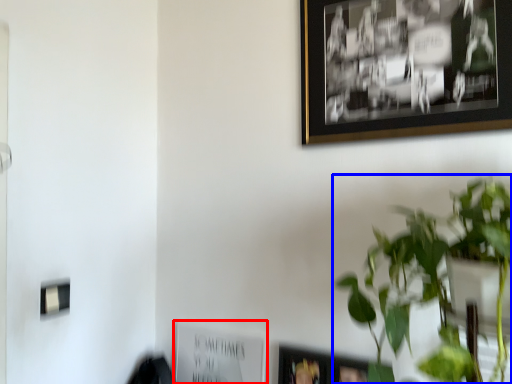
Question: Which of the following is the closest to the observer, picture frame (highlighted by a red box) or houseplant (highlighted by a blue box)?

Choices:
 (A) picture frame
 (B) houseplant

Answer: (B)